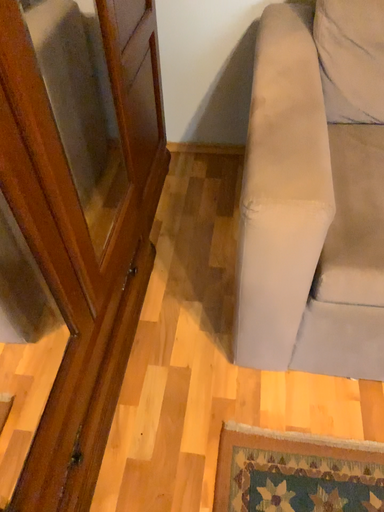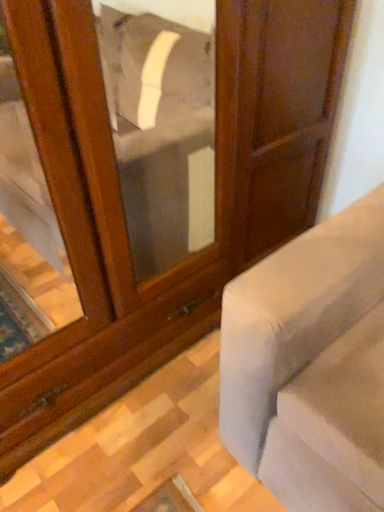
Question: Which way did the camera rotate in the video?

Choices:
 (A) rotated left
 (B) rotated right

Answer: (A)